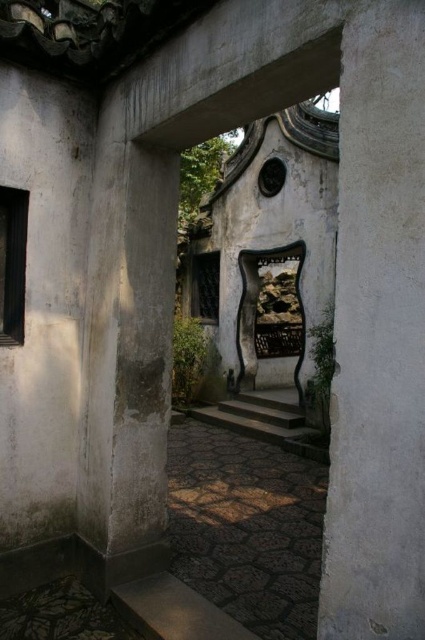
Question: Which of the following is the farthest from the observer?

Choices:
 (A) white concrete pillar at right
 (B) dark gray stone stairs at center

Answer: (B)

Question: Can you confirm if white concrete pillar at right is smaller than dark gray stone stairs at center?

Choices:
 (A) no
 (B) yes

Answer: (B)

Question: Among these points, which one is nearest to the camera?

Choices:
 (A) (229, 403)
 (B) (373, 451)

Answer: (B)

Question: Is white concrete pillar at right further to the viewer compared to dark gray stone stairs at center?

Choices:
 (A) yes
 (B) no

Answer: (B)

Question: Is white concrete pillar at right below dark gray stone stairs at center?

Choices:
 (A) yes
 (B) no

Answer: (B)